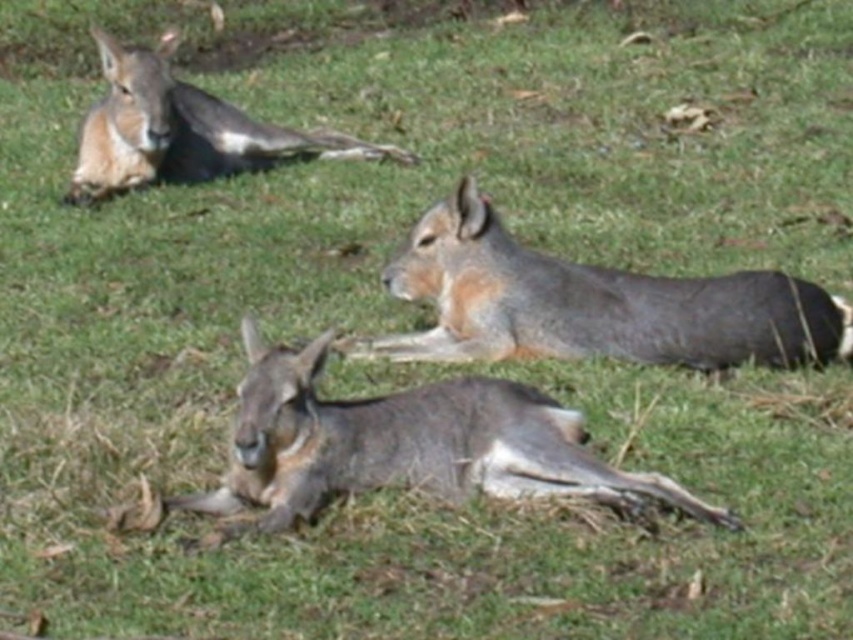
Question: Which point is closer to the camera?

Choices:
 (A) gray fur rabbit at center
 (B) gray fur kangaroo at lower center

Answer: (B)

Question: Which of the following is the closest to the observer?

Choices:
 (A) gray fur kangaroo at lower center
 (B) gray fur rabbit at center

Answer: (A)

Question: Is gray fur rabbit at center behind gray fur kangaroo at upper left?

Choices:
 (A) no
 (B) yes

Answer: (A)

Question: Does gray fur rabbit at center appear on the left side of gray fur kangaroo at upper left?

Choices:
 (A) yes
 (B) no

Answer: (B)

Question: Which object is positioned closest to the gray fur kangaroo at lower center?

Choices:
 (A) gray fur rabbit at center
 (B) gray fur kangaroo at upper left

Answer: (A)

Question: Does gray fur kangaroo at lower center have a greater width compared to gray fur kangaroo at upper left?

Choices:
 (A) no
 (B) yes

Answer: (A)